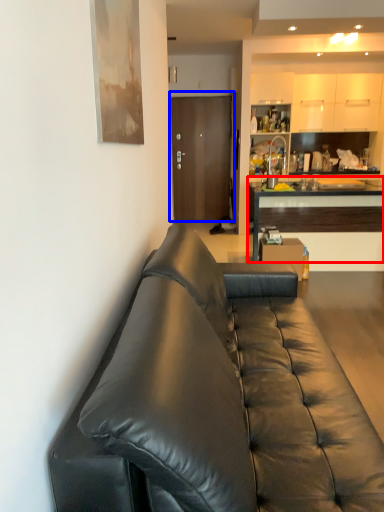
Question: Which of the following is the farthest to the observer, cabinetry (highlighted by a red box) or door (highlighted by a blue box)?

Choices:
 (A) cabinetry
 (B) door

Answer: (B)